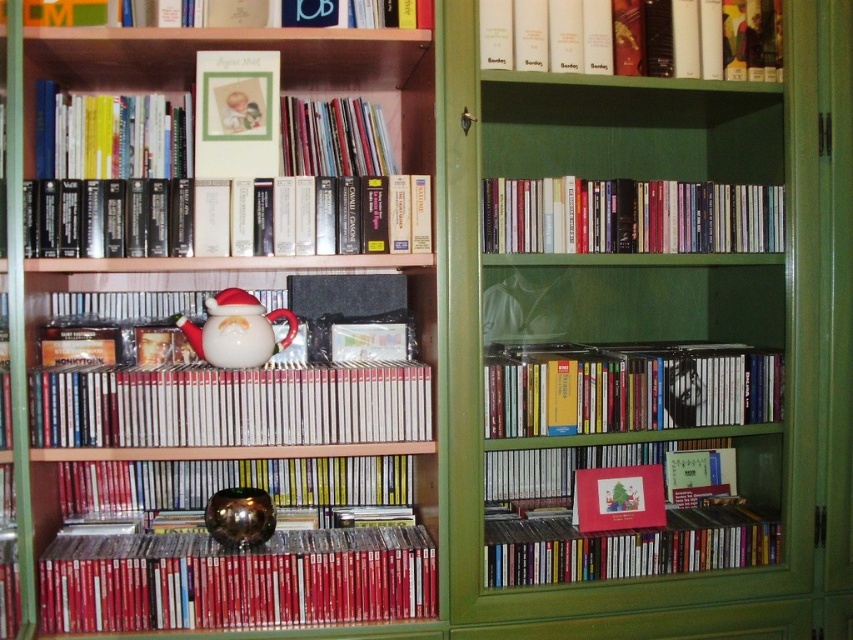
Is green matte bookshelf at center above hardcover book at upper left?

Incorrect, green matte bookshelf at center is not positioned above hardcover book at upper left.

Is green matte bookshelf at center below hardcover book at upper left?

Yes, green matte bookshelf at center is below hardcover book at upper left.

Which is behind, point (483, 129) or point (292, 209)?

The point (483, 129) is more distant.

Locate an element on the screen. The height and width of the screenshot is (640, 853). green matte bookshelf at center is located at coordinates (637, 316).

Between point (379, 220) and point (709, 397), which one is positioned behind?

The point (709, 397) is more distant.

How much distance is there between hardcover book at upper left and hardcover book at center?

The distance of hardcover book at upper left from hardcover book at center is 20.47 inches.

Is point (234, 236) more distant than point (527, 424)?

No, (234, 236) is closer to viewer.

Image resolution: width=853 pixels, height=640 pixels. What are the coordinates of `hardcover book at upper left` in the screenshot? It's located at (219, 182).

Between green matte bookshelf at center and white matte cd at center, which one is positioned higher?

Positioned higher is green matte bookshelf at center.

Image resolution: width=853 pixels, height=640 pixels. What are the coordinates of `green matte bookshelf at center` in the screenshot? It's located at (637, 316).